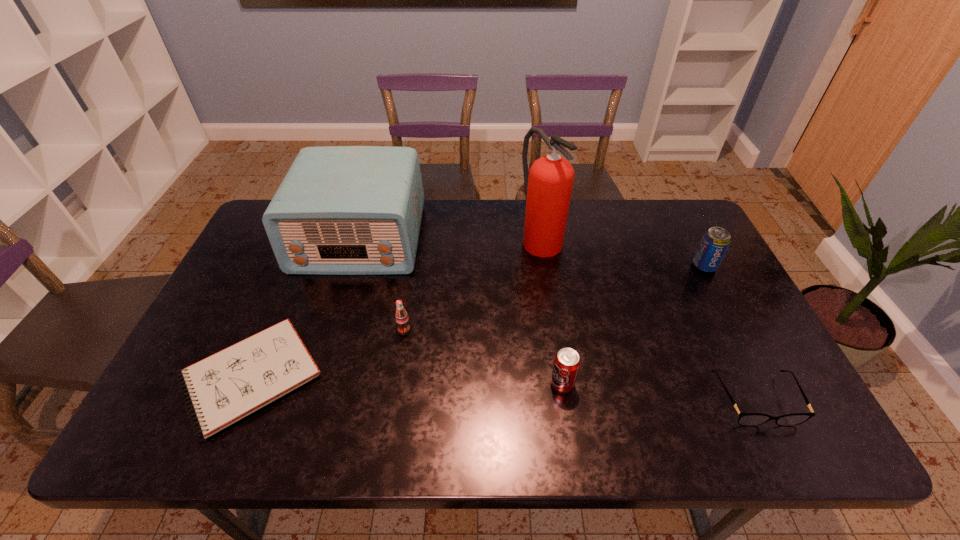
Find the location of `spectacles that is at the right edge`. spectacles that is at the right edge is located at coordinates (745, 419).

The height and width of the screenshot is (540, 960). What are the coordinates of `object that is at the far left corner` in the screenshot? It's located at (340, 210).

This screenshot has width=960, height=540. I want to click on object located in the near left corner section of the desktop, so click(x=225, y=387).

This screenshot has height=540, width=960. I want to click on object that is positioned at the near right corner, so click(745, 419).

The height and width of the screenshot is (540, 960). In order to click on free point at the near edge in this screenshot , I will do `click(441, 415)`.

Where is `vacant space at the left edge of the desktop`? This screenshot has width=960, height=540. vacant space at the left edge of the desktop is located at coordinates (193, 409).

At what (x,y) coordinates should I click in order to perform the action: click on free space at the right edge of the desktop. Please return your answer as a coordinate pair (x, y). This screenshot has height=540, width=960. Looking at the image, I should click on (765, 372).

This screenshot has height=540, width=960. Find the location of `free region at the far right corner of the desktop`. free region at the far right corner of the desktop is located at coordinates (662, 212).

This screenshot has height=540, width=960. In order to click on vacant region at the near right corner of the desktop in this screenshot , I will do `click(769, 445)`.

Locate an element on the screen. The height and width of the screenshot is (540, 960). vacant region between the nearest soda and the notepad is located at coordinates (406, 381).